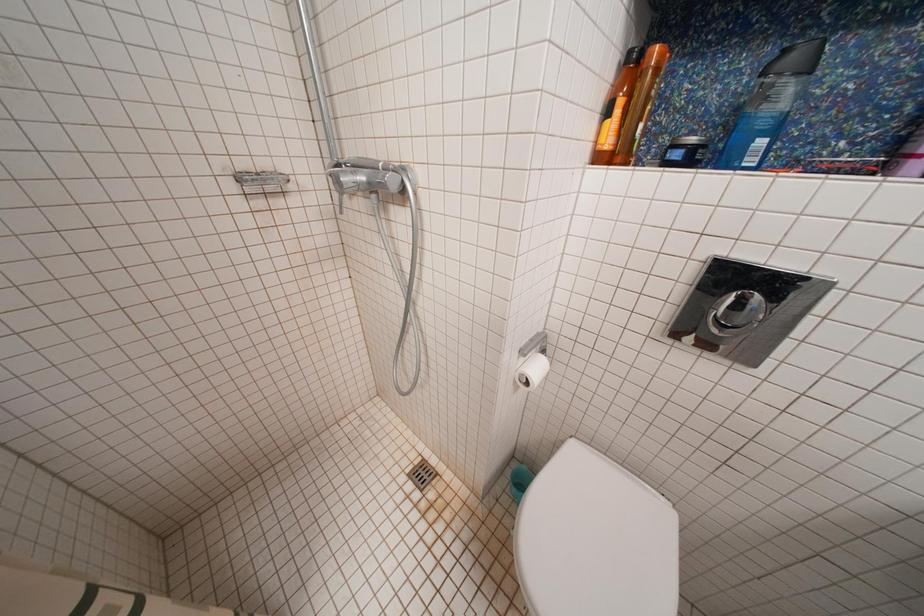
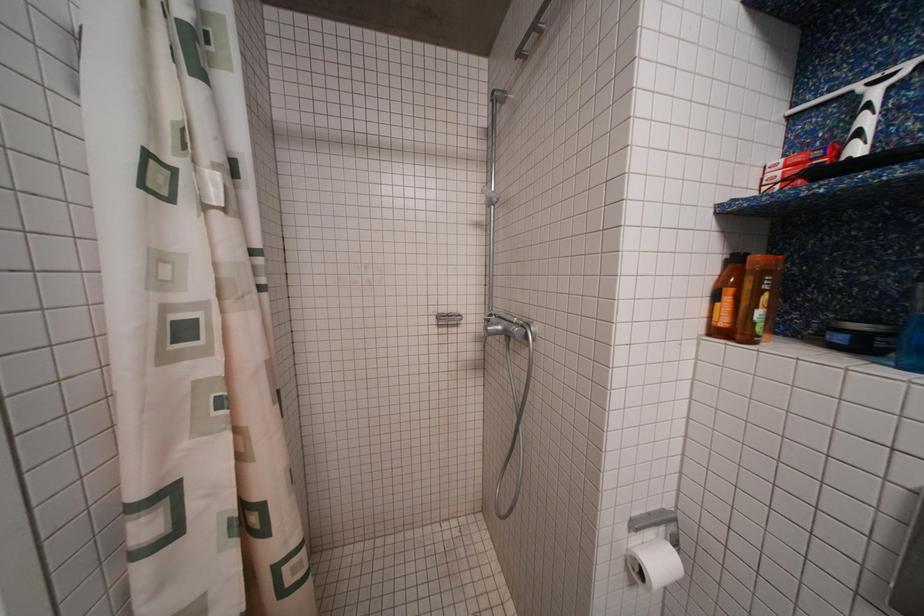
The first image is from the beginning of the video and the second image is from the end. How did the camera likely rotate when shooting the video?

The camera's rotation is toward left-up.